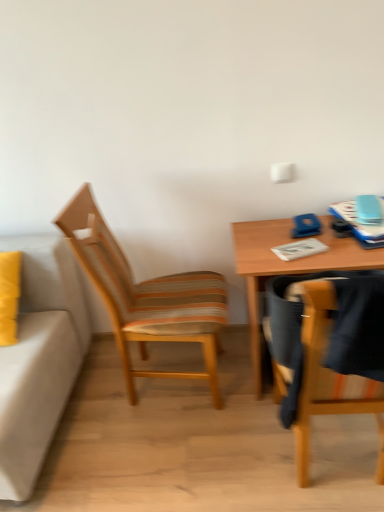
Where is `free point to the left of white paper notepad at center`? free point to the left of white paper notepad at center is located at coordinates (260, 246).